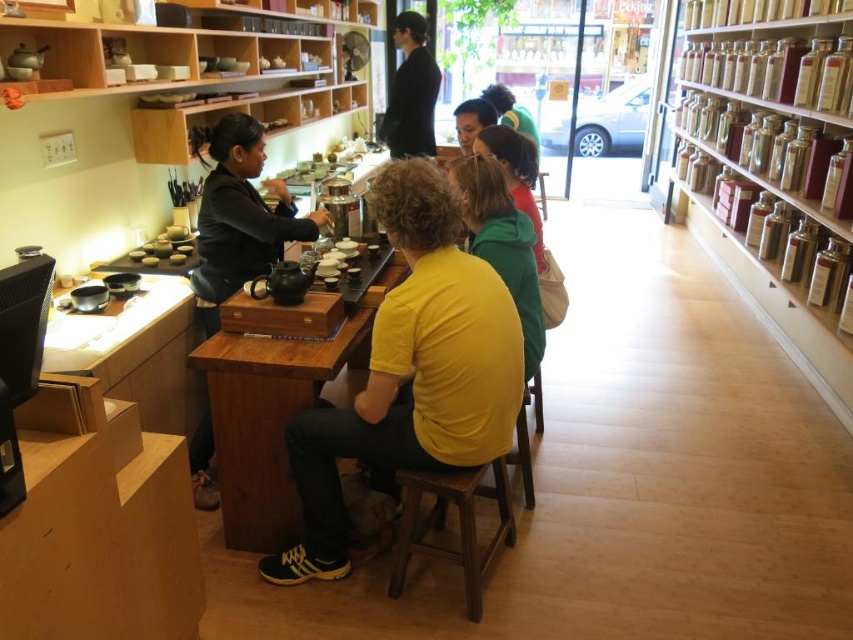
Can you confirm if brown wooden stool at lower center is wider than green matte hoodie at center?

Yes, brown wooden stool at lower center is wider than green matte hoodie at center.

The width and height of the screenshot is (853, 640). I want to click on brown wooden stool at lower center, so click(x=457, y=522).

Between point (457, 486) and point (474, 150), which one is positioned in front?

Positioned in front is point (457, 486).

The image size is (853, 640). In order to click on brown wooden stool at lower center in this screenshot , I will do `click(457, 522)`.

Who is positioned more to the left, green matte jacket at center or black smooth shirt at upper center?

black smooth shirt at upper center

Does green matte jacket at center appear on the right side of black smooth shirt at upper center?

Yes, green matte jacket at center is to the right of black smooth shirt at upper center.

Locate an element on the screen. green matte jacket at center is located at coordinates (502, 244).

You are a GUI agent. You are given a task and a screenshot of the screen. Output one action in this format:
    pyautogui.click(x=<x>, y=<y>)
    Task: Click on the green matte jacket at center
    
    Given the screenshot: What is the action you would take?
    pyautogui.click(x=502, y=244)

Does point (496, 259) come in front of point (526, 164)?

Yes.

Is green matte jacket at center behind green matte hoodie at center?

No, it is not.

Does point (531, 269) come farther from viewer compared to point (529, 204)?

No, it is in front of (529, 204).

Locate an element on the screen. The width and height of the screenshot is (853, 640). green matte jacket at center is located at coordinates (502, 244).